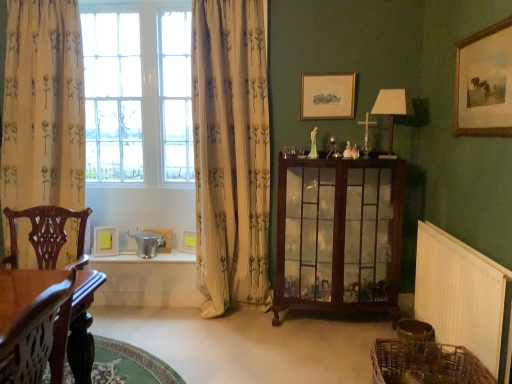
I want to click on vacant area in front of mahogany glass cabinet at center, so click(313, 350).